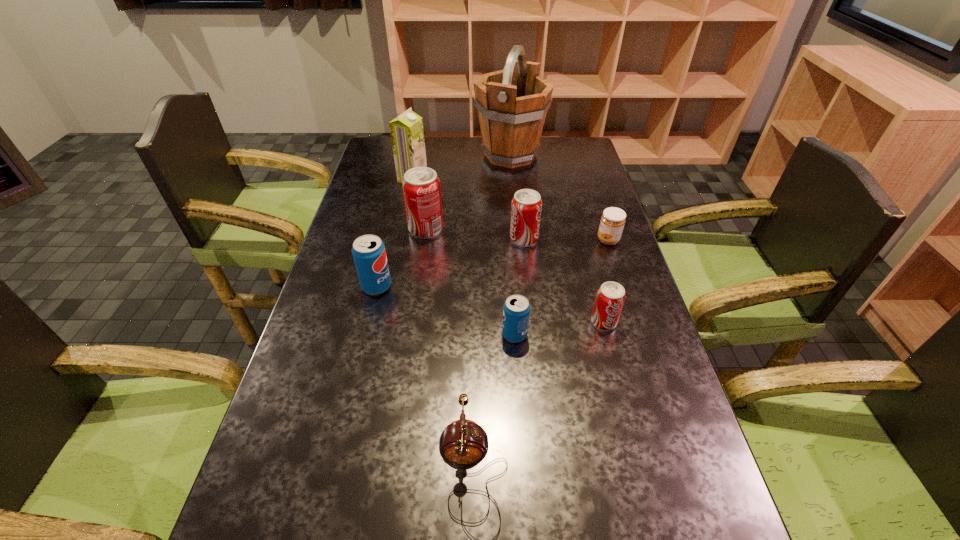
Where is `the nearer blue soda can`? This screenshot has width=960, height=540. the nearer blue soda can is located at coordinates (516, 311).

Find the location of a particular element. Image resolution: width=960 pixels, height=540 pixels. the right blue soda can is located at coordinates tap(516, 311).

Locate an element on the screen. The height and width of the screenshot is (540, 960). orange jam is located at coordinates (612, 222).

Find the location of a particular element. This screenshot has width=960, height=540. jam is located at coordinates (612, 222).

This screenshot has height=540, width=960. In order to click on free location located on the front of the bucket in this screenshot , I will do `click(519, 245)`.

Identify the location of vacant space located on the front of the green soya milk. The image size is (960, 540). (407, 205).

At what (x,y) coordinates should I click in order to perform the action: click on free space located on the right of the third tallest object. Please return your answer as a coordinate pair (x, y). The width and height of the screenshot is (960, 540). Looking at the image, I should click on (494, 230).

Identify the location of vacant space located 0.310m on the left of the second red soda can from left to right. (408, 239).

Where is `vacant region located on the front of the fourth nearest object`? Image resolution: width=960 pixels, height=540 pixels. vacant region located on the front of the fourth nearest object is located at coordinates click(x=348, y=410).

Locate an element on the screen. The width and height of the screenshot is (960, 540). free space located on the front of the eighth object from left to right is located at coordinates (630, 423).